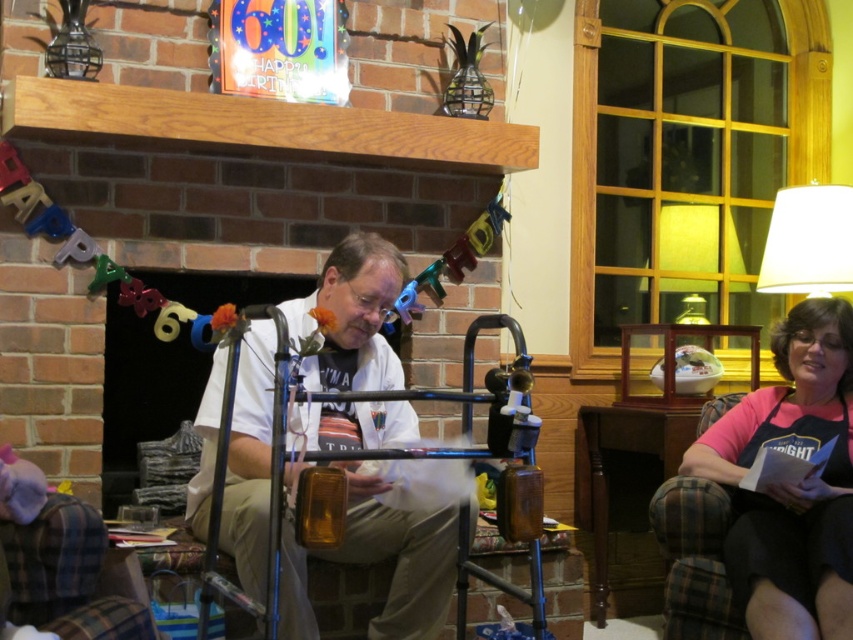
You are helping to organize the living room for a party. You have a pink fabric apron at lower right and a matte glass lampshade at upper right. Which object should you adjust if you need to make space for a larger decoration, and why?

You should adjust the pink fabric apron at lower right because it is bigger than the matte glass lampshade at upper right, so moving it would free up more space.

You are a guest at the 60th birthday party and want to approach the man sitting on the chair near the fireplace. The white matte walker at center is in your path. Based on its coordinates, can you estimate if there is enough space to walk around it?

The white matte walker at center is positioned at coordinates point (352, 316). Since the exact dimensions of the space aren not provided, it is difficult to determine if there is enough space to walk around it without additional information about the room layout and the walker size.

You are standing in the living room and see the pink fabric apron at lower right. Where exactly is it positioned relative to the fireplace?

The pink fabric apron at lower right is located at point (790, 484) relative to the fireplace.